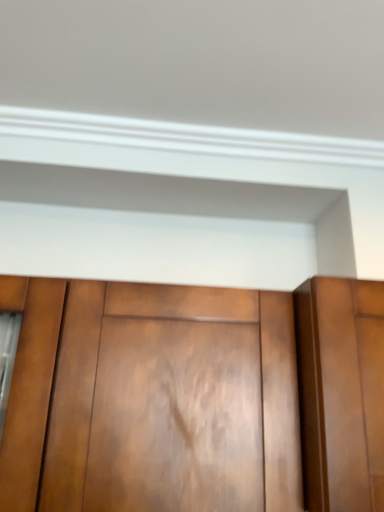
This screenshot has width=384, height=512. What do you see at coordinates (194, 397) in the screenshot?
I see `shiny brown wood cupboard at center` at bounding box center [194, 397].

At what (x,y) coordinates should I click in order to perform the action: click on shiny brown wood cupboard at center. Please return your answer as a coordinate pair (x, y). Image resolution: width=384 pixels, height=512 pixels. Looking at the image, I should click on (194, 397).

What do you see at coordinates (341, 392) in the screenshot? This screenshot has height=512, width=384. I see `glossy wood door at center` at bounding box center [341, 392].

Identify the location of glossy wood door at center. This screenshot has width=384, height=512. (341, 392).

Measure the distance between glossy wood door at center and camera.

glossy wood door at center and camera are 26.18 inches apart from each other.

The width and height of the screenshot is (384, 512). I want to click on shiny brown wood cupboard at center, so click(194, 397).

Considering the relative positions of shiny brown wood cupboard at center and glossy wood door at center in the image provided, is shiny brown wood cupboard at center to the left of glossy wood door at center from the viewer's perspective?

Correct, you'll find shiny brown wood cupboard at center to the left of glossy wood door at center.

Relative to glossy wood door at center, is shiny brown wood cupboard at center in front or behind?

Clearly, shiny brown wood cupboard at center is behind glossy wood door at center.

Does point (106, 366) appear closer or farther from the camera than point (323, 474)?

Point (106, 366) is positioned farther from the camera compared to point (323, 474).

From the image's perspective, which one is positioned higher, shiny brown wood cupboard at center or glossy wood door at center?

From the image's view, glossy wood door at center is above.

From a real-world perspective, is shiny brown wood cupboard at center located beneath glossy wood door at center?

Yes.

Is shiny brown wood cupboard at center wider or thinner than glossy wood door at center?

Clearly, shiny brown wood cupboard at center has less width compared to glossy wood door at center.

Considering the relative sizes of shiny brown wood cupboard at center and glossy wood door at center in the image provided, is shiny brown wood cupboard at center shorter than glossy wood door at center?

In fact, shiny brown wood cupboard at center may be taller than glossy wood door at center.

Does shiny brown wood cupboard at center have a larger size compared to glossy wood door at center?

Indeed, shiny brown wood cupboard at center has a larger size compared to glossy wood door at center.

Is glossy wood door at center inside shiny brown wood cupboard at center?

That's incorrect, glossy wood door at center is not inside shiny brown wood cupboard at center.

Is shiny brown wood cupboard at center not near glossy wood door at center?

No, shiny brown wood cupboard at center is not far away from glossy wood door at center.

Is glossy wood door at center at the back of shiny brown wood cupboard at center?

shiny brown wood cupboard at center is not turned away from glossy wood door at center.

What's the angular difference between shiny brown wood cupboard at center and glossy wood door at center's facing directions?

They differ by 0.355 degrees in their facing directions.

Where is `cupboard behind the glossy wood door at center`? Image resolution: width=384 pixels, height=512 pixels. cupboard behind the glossy wood door at center is located at coordinates (194, 397).

Considering the relative positions of glossy wood door at center and shiny brown wood cupboard at center in the image provided, is glossy wood door at center to the right of shiny brown wood cupboard at center from the viewer's perspective?

Yes.

Which object is closer to the camera taking this photo, glossy wood door at center or shiny brown wood cupboard at center?

glossy wood door at center.

Considering the points (319, 493) and (57, 326), which point is behind, point (319, 493) or point (57, 326)?

The point (57, 326) is farther from the camera.

From the image's perspective, which object appears higher, glossy wood door at center or shiny brown wood cupboard at center?

glossy wood door at center is shown above in the image.

From a real-world perspective, which is physically above, glossy wood door at center or shiny brown wood cupboard at center?

A: In real-world perspective, glossy wood door at center is above.

Does glossy wood door at center have a lesser width compared to shiny brown wood cupboard at center?

No, glossy wood door at center is not thinner than shiny brown wood cupboard at center.

Between glossy wood door at center and shiny brown wood cupboard at center, which one has more height?

shiny brown wood cupboard at center.

Considering the sizes of objects glossy wood door at center and shiny brown wood cupboard at center in the image provided, who is bigger, glossy wood door at center or shiny brown wood cupboard at center?

shiny brown wood cupboard at center.

Is glossy wood door at center inside or outside of shiny brown wood cupboard at center?

glossy wood door at center is spatially situated outside shiny brown wood cupboard at center.

Is glossy wood door at center positioned far away from shiny brown wood cupboard at center?

They are positioned close to each other.

Is glossy wood door at center facing away from shiny brown wood cupboard at center?

No, glossy wood door at center's orientation is not away from shiny brown wood cupboard at center.

Looking at this image, what's the angular difference between glossy wood door at center and shiny brown wood cupboard at center's facing directions?

0.355 degrees.

I want to click on door in front of the shiny brown wood cupboard at center, so click(341, 392).

Find the location of `door above the shiny brown wood cupboard at center (from the image's perspective)`. door above the shiny brown wood cupboard at center (from the image's perspective) is located at coordinates (341, 392).

Locate an element on the screen. cupboard below the glossy wood door at center (from a real-world perspective) is located at coordinates (194, 397).